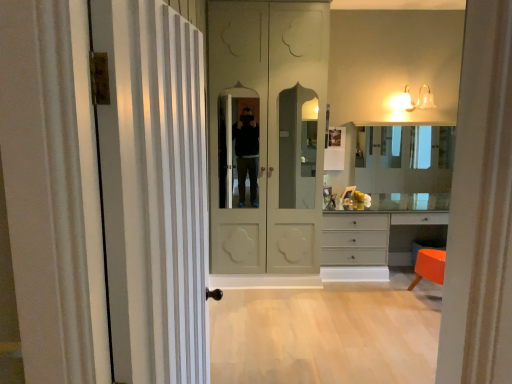
Measure the distance between light wood floor at lower center and camera.

light wood floor at lower center and camera are 2.68 meters apart from each other.

Where is `white striped door at left, the 2th door positioned from the back`? This screenshot has width=512, height=384. white striped door at left, the 2th door positioned from the back is located at coordinates (154, 191).

This screenshot has width=512, height=384. Describe the element at coordinates (267, 134) in the screenshot. I see `matte cream door at center, which is the first door in back-to-front order` at that location.

Locate an element on the screen. The height and width of the screenshot is (384, 512). clear glass mirror at center is located at coordinates (407, 159).

Consider the image. Is matte cream door at center, which is the first door in back-to-front order, completely or partially outside of matte white bell-shaped light fixture at upper right?

Indeed, matte cream door at center, which is the first door in back-to-front order, is completely outside matte white bell-shaped light fixture at upper right.

How much distance is there between matte cream door at center, which appears as the second door when viewed from the front, and matte white bell-shaped light fixture at upper right?

The distance of matte cream door at center, which appears as the second door when viewed from the front, from matte white bell-shaped light fixture at upper right is 5.31 feet.

Who is bigger, matte cream door at center, which appears as the second door when viewed from the front, or matte white bell-shaped light fixture at upper right?

matte cream door at center, which appears as the second door when viewed from the front.

From the image's perspective, is matte cream door at center, which appears as the second door when viewed from the front, under matte white bell-shaped light fixture at upper right?

Yes, from the image's perspective, matte cream door at center, which appears as the second door when viewed from the front, is below matte white bell-shaped light fixture at upper right.

From the image's perspective, which one is positioned higher, light wood floor at lower center or matte gray dresser at lower right?

matte gray dresser at lower right appears higher in the image.

Is light wood floor at lower center facing towards matte gray dresser at lower right?

No, light wood floor at lower center is not facing towards matte gray dresser at lower right.

In the image, is light wood floor at lower center on the left side or the right side of matte gray dresser at lower right?

Clearly, light wood floor at lower center is on the left of matte gray dresser at lower right in the image.

Between point (424, 164) and point (419, 228), which one is positioned behind?

The point (419, 228) is farther.

Is clear glass mirror at center wider or thinner than matte gray dresser at lower right?

Clearly, clear glass mirror at center has less width compared to matte gray dresser at lower right.

From a real-world perspective, is clear glass mirror at center above or below matte gray dresser at lower right?

From a real-world perspective, clear glass mirror at center is physically above matte gray dresser at lower right.

Is clear glass mirror at center situated inside matte gray dresser at lower right or outside?

clear glass mirror at center is not enclosed by matte gray dresser at lower right.

Considering the positions of objects clear glass mirror at center and matte white bell-shaped light fixture at upper right in the image provided, who is more to the left, clear glass mirror at center or matte white bell-shaped light fixture at upper right?

matte white bell-shaped light fixture at upper right is more to the left.

Between clear glass mirror at center and matte white bell-shaped light fixture at upper right, which one is positioned in front?

matte white bell-shaped light fixture at upper right.

Are clear glass mirror at center and matte white bell-shaped light fixture at upper right far apart?

Actually, clear glass mirror at center and matte white bell-shaped light fixture at upper right are a little close together.

In the scene shown: Is white striped door at left, the 2th door positioned from the back, next to matte gray dresser at lower right?

white striped door at left, the 2th door positioned from the back, and matte gray dresser at lower right are clearly separated.

From the image's perspective, which one is positioned lower, white striped door at left, which is counted as the 1th door, starting from the front, or matte gray dresser at lower right?

matte gray dresser at lower right.

Which door is the 2nd one when counting from the left side of the matte gray dresser at lower right? Please provide its 2D coordinates.

[(154, 191)]

From a real-world perspective, who is located higher, white striped door at left, which is counted as the 1th door, starting from the front, or matte gray dresser at lower right?

white striped door at left, which is counted as the 1th door, starting from the front.

Is matte cream door at center, which appears as the second door when viewed from the front, surrounding matte gray dresser at lower right?

That's incorrect, matte gray dresser at lower right is not inside matte cream door at center, which appears as the second door when viewed from the front.

Between point (267, 187) and point (358, 245), which one is positioned in front?

The point (267, 187) is closer.

Visually, is matte cream door at center, which appears as the second door when viewed from the front, positioned to the left or to the right of matte gray dresser at lower right?

Clearly, matte cream door at center, which appears as the second door when viewed from the front, is on the left of matte gray dresser at lower right in the image.

Is matte white bell-shaped light fixture at upper right aimed at white striped door at left, the 2th door positioned from the back?

No, matte white bell-shaped light fixture at upper right is not oriented towards white striped door at left, the 2th door positioned from the back.

Can you confirm if matte white bell-shaped light fixture at upper right is wider than white striped door at left, the 2th door positioned from the back?

Indeed, matte white bell-shaped light fixture at upper right has a greater width compared to white striped door at left, the 2th door positioned from the back.

Considering their positions, is matte white bell-shaped light fixture at upper right located in front of or behind white striped door at left, the 2th door positioned from the back?

Clearly, matte white bell-shaped light fixture at upper right is behind white striped door at left, the 2th door positioned from the back.

Considering the positions of objects matte white bell-shaped light fixture at upper right and white striped door at left, which is counted as the 1th door, starting from the front, in the image provided, who is more to the right, matte white bell-shaped light fixture at upper right or white striped door at left, which is counted as the 1th door, starting from the front,?

From the viewer's perspective, matte white bell-shaped light fixture at upper right appears more on the right side.

Locate an element on the screen. light fixture on the right of the matte cream door at center, which is the first door in back-to-front order is located at coordinates (413, 101).

Identify the location of the chest of drawers above the light wood floor at lower center (from the image's perspective). The height and width of the screenshot is (384, 512). (374, 242).

Which object lies further to the anchor point matte white bell-shaped light fixture at upper right, light wood floor at lower center or white striped door at left, which is counted as the 1th door, starting from the front?

white striped door at left, which is counted as the 1th door, starting from the front, is positioned further to the anchor matte white bell-shaped light fixture at upper right.

Considering their positions, is light wood floor at lower center positioned closer to clear glass mirror at center than white striped door at left, the 2th door positioned from the back?

light wood floor at lower center lies closer to clear glass mirror at center than the other object.

Which object lies nearer to the anchor point clear glass mirror at center, matte cream door at center, which appears as the second door when viewed from the front, or matte white bell-shaped light fixture at upper right?

Among the two, matte white bell-shaped light fixture at upper right is located nearer to clear glass mirror at center.

From the image, which object appears to be nearer to light wood floor at lower center, matte cream door at center, which appears as the second door when viewed from the front, or clear glass mirror at center?

matte cream door at center, which appears as the second door when viewed from the front, is closer to light wood floor at lower center.

Based on the photo, considering their positions, is matte white bell-shaped light fixture at upper right positioned further to matte gray dresser at lower right than matte cream door at center, which is the first door in back-to-front order?

Among the two, matte white bell-shaped light fixture at upper right is located further to matte gray dresser at lower right.

From the image, which object appears to be nearer to clear glass mirror at center, matte white bell-shaped light fixture at upper right or white striped door at left, the 2th door positioned from the back?

matte white bell-shaped light fixture at upper right.

Considering their positions, is light wood floor at lower center positioned further to matte white bell-shaped light fixture at upper right than clear glass mirror at center?

Based on the image, light wood floor at lower center appears to be further to matte white bell-shaped light fixture at upper right.

When comparing their distances from matte white bell-shaped light fixture at upper right, does light wood floor at lower center or matte gray dresser at lower right seem closer?

Among the two, matte gray dresser at lower right is located nearer to matte white bell-shaped light fixture at upper right.

Where is `plain between white striped door at left, the 2th door positioned from the back, and matte white bell-shaped light fixture at upper right, along the z-axis`? The width and height of the screenshot is (512, 384). plain between white striped door at left, the 2th door positioned from the back, and matte white bell-shaped light fixture at upper right, along the z-axis is located at coordinates (325, 335).

What are the coordinates of `plain between white striped door at left, the 2th door positioned from the back, and matte cream door at center, which appears as the second door when viewed from the front, along the z-axis` in the screenshot? It's located at (325, 335).

Locate an element on the screen. The width and height of the screenshot is (512, 384). plain between white striped door at left, which is counted as the 1th door, starting from the front, and clear glass mirror at center in the front-back direction is located at coordinates (325, 335).

Where is `door located between white striped door at left, which is counted as the 1th door, starting from the front, and clear glass mirror at center in the depth direction`? door located between white striped door at left, which is counted as the 1th door, starting from the front, and clear glass mirror at center in the depth direction is located at coordinates (267, 134).